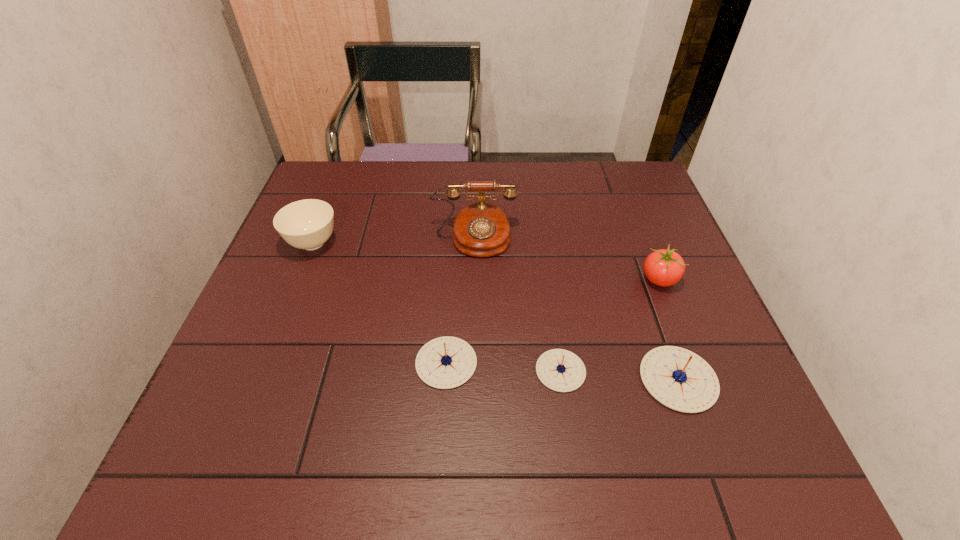
The width and height of the screenshot is (960, 540). I want to click on free region at the left edge of the desktop, so click(275, 265).

You are a GUI agent. You are given a task and a screenshot of the screen. Output one action in this format:
    pyautogui.click(x=<x>, y=<y>)
    Task: Click on the vacant area at the far left corner
    This screenshot has width=960, height=540.
    Given the screenshot: What is the action you would take?
    pyautogui.click(x=337, y=199)

In the image, there is a desktop. Identify the location of free region at the far right corner. (604, 198).

In the image, there is a desktop. What are the coordinates of `vacant space at the near right corner` in the screenshot? It's located at 730,383.

The image size is (960, 540). Find the location of `unoccupied position between the second compass from right to left and the sugar bowl`. unoccupied position between the second compass from right to left and the sugar bowl is located at coordinates (437, 307).

The image size is (960, 540). I want to click on free area in between the tomato and the sugar bowl, so click(x=487, y=262).

Find the location of `vacant point located between the second shortest compass and the tallest object`. vacant point located between the second shortest compass and the tallest object is located at coordinates (460, 300).

Image resolution: width=960 pixels, height=540 pixels. I want to click on free space between the leftmost object and the second compass from left to right, so click(437, 307).

The width and height of the screenshot is (960, 540). What are the coordinates of `vacant area between the tallest compass and the leftmost object` in the screenshot? It's located at (495, 311).

The image size is (960, 540). What are the coordinates of `free area in between the fourth nearest object and the leftmost object` in the screenshot? It's located at (487, 262).